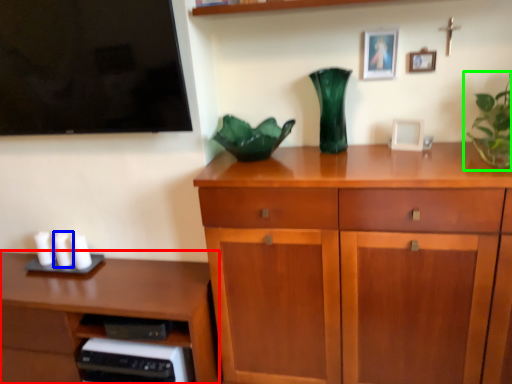
Question: Considering the real-world distances, which object is closest to desk (highlighted by a red box)? candle (highlighted by a blue box) or houseplant (highlighted by a green box).

Choices:
 (A) candle
 (B) houseplant

Answer: (A)